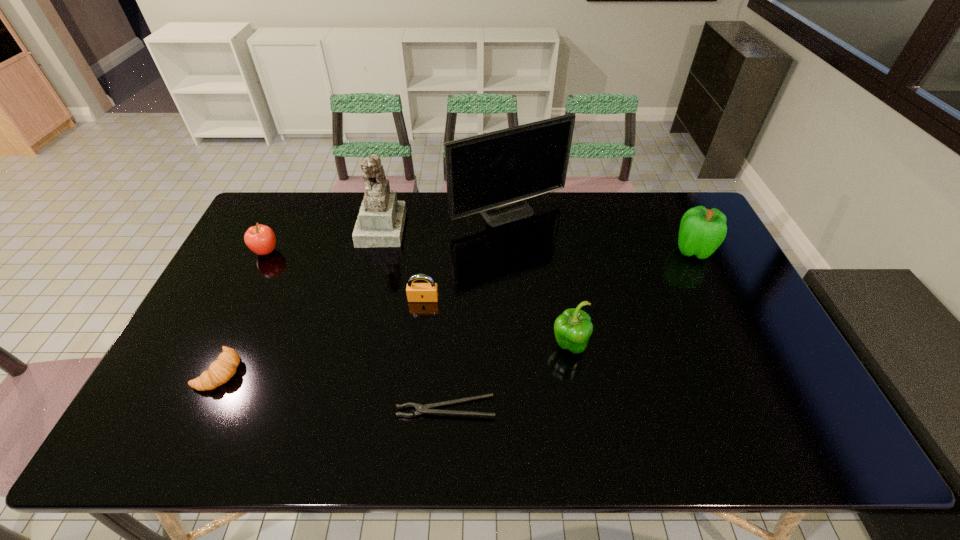
The image size is (960, 540). What are the coordinates of `vacant point located between the apple and the figurine` in the screenshot? It's located at (324, 239).

I want to click on vacant space in between the nearer bell pepper and the fifth farthest object, so click(495, 322).

In order to click on vacant area that lies between the nearest object and the crescent roll in this screenshot , I will do `click(333, 389)`.

Find the location of `vacant region between the figurine and the apple`. vacant region between the figurine and the apple is located at coordinates (324, 239).

This screenshot has height=540, width=960. I want to click on free space between the shortest object and the padlock, so click(x=435, y=353).

This screenshot has height=540, width=960. I want to click on empty space between the farther bell pepper and the apple, so click(480, 251).

What are the coordinates of `vacant area that lies between the sixth object from right to left and the farther bell pepper` in the screenshot? It's located at (538, 238).

You are a GUI agent. You are given a task and a screenshot of the screen. Output one action in this format:
    pyautogui.click(x=<x>, y=<y>)
    Task: Click on the free area in between the crescent roll and the nearest object
    
    Given the screenshot: What is the action you would take?
    pyautogui.click(x=333, y=389)

At what (x,y) coordinates should I click in order to perform the action: click on vacant area that lies between the right bell pepper and the seventh tallest object. Please return your answer as a coordinate pair (x, y). Looking at the image, I should click on (457, 310).

Where is `object that is the closest one to the computer monitor`? The width and height of the screenshot is (960, 540). object that is the closest one to the computer monitor is located at coordinates (380, 223).